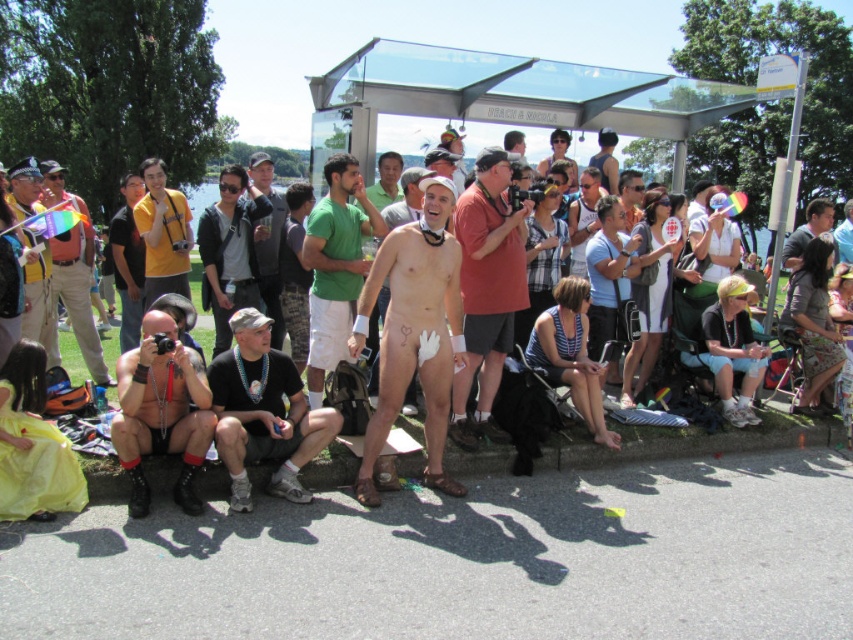
Based on the photo, is matte skin man at center bigger than matte black camera at center?

Actually, matte skin man at center might be smaller than matte black camera at center.

How much distance is there between matte skin man at center and matte black camera at center?

matte skin man at center and matte black camera at center are 8.88 feet apart from each other.

What do you see at coordinates (688, 444) in the screenshot? I see `matte skin man at center` at bounding box center [688, 444].

This screenshot has height=640, width=853. Identify the location of matte skin man at center. (688, 444).

Who is lower down, matte gray hoodie at center or gray fabric shirt at center?

matte gray hoodie at center

Which is behind, point (242, 252) or point (821, 212)?

The point (821, 212) is behind.

Which is in front, point (241, 176) or point (799, 252)?

Point (241, 176) is more forward.

The width and height of the screenshot is (853, 640). Identify the location of matte gray hoodie at center. (230, 252).

Does green matte shorts at center appear over gray fabric shirt at center?

Actually, green matte shorts at center is below gray fabric shirt at center.

Who is shorter, green matte shorts at center or gray fabric shirt at center?

With less height is gray fabric shirt at center.

Who is more forward, [321,248] or [809,216]?

Point [321,248]

Find the location of a particular element. green matte shorts at center is located at coordinates [335, 266].